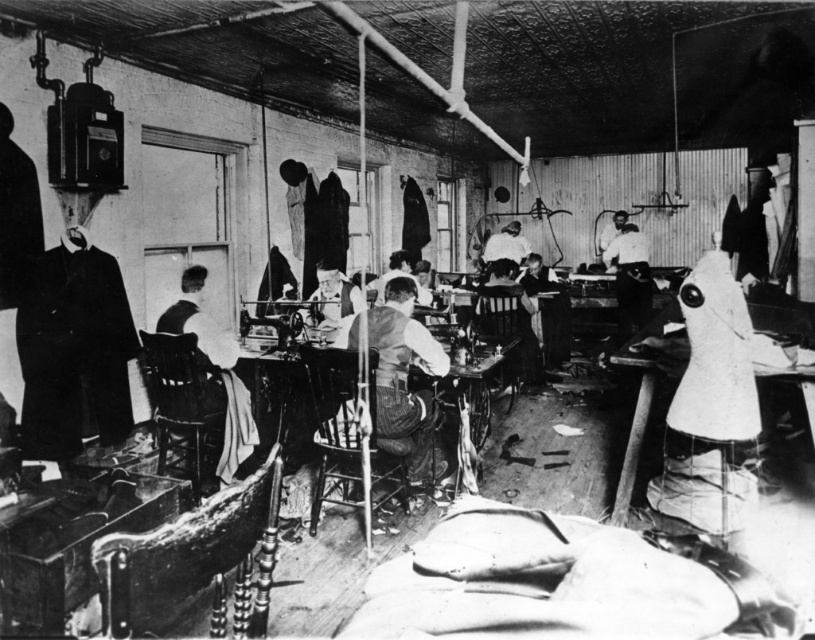
Question: Can you confirm if matte black vest at center is positioned to the left of light brown leather jacket at center?

Choices:
 (A) yes
 (B) no

Answer: (B)

Question: Which point is closer to the camera?

Choices:
 (A) light brown leather jacket at center
 (B) white fabric shirt at upper center
 (C) matte black vest at center

Answer: (C)

Question: Estimate the real-world distances between objects in this image. Which object is farther from the light brown leather jacket at center?

Choices:
 (A) matte black vest at center
 (B) white fabric shirt at upper center

Answer: (B)

Question: Which point is closer to the camera?

Choices:
 (A) (380, 275)
 (B) (430, 480)

Answer: (B)

Question: Does matte black vest at center have a smaller size compared to white fabric shirt at upper center?

Choices:
 (A) no
 (B) yes

Answer: (A)

Question: Does matte black vest at center appear under white fabric shirt at upper center?

Choices:
 (A) yes
 (B) no

Answer: (A)